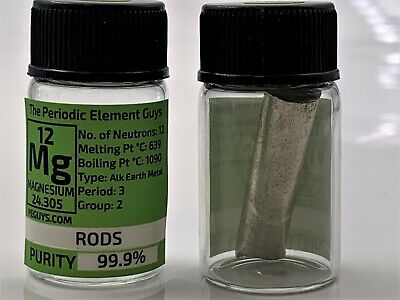
Locate an element on the screen. The height and width of the screenshot is (300, 400). wall is located at coordinates (362, 95), (25, 77).